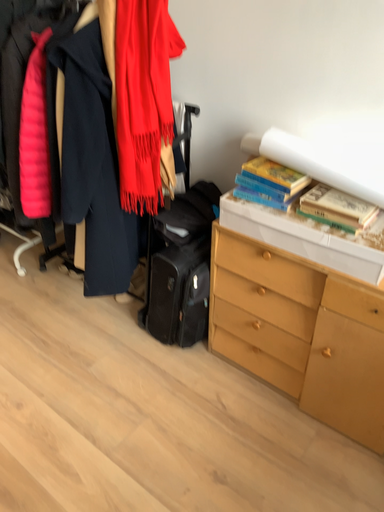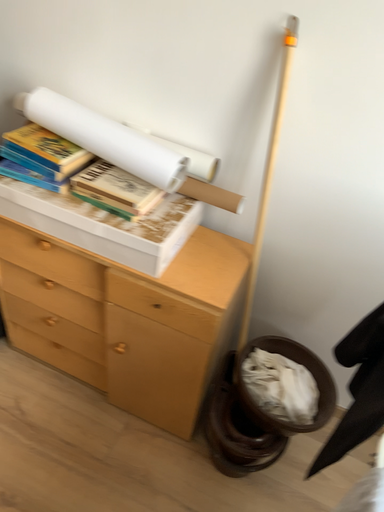
Question: How did the camera likely rotate when shooting the video?

Choices:
 (A) rotated left
 (B) rotated right

Answer: (B)